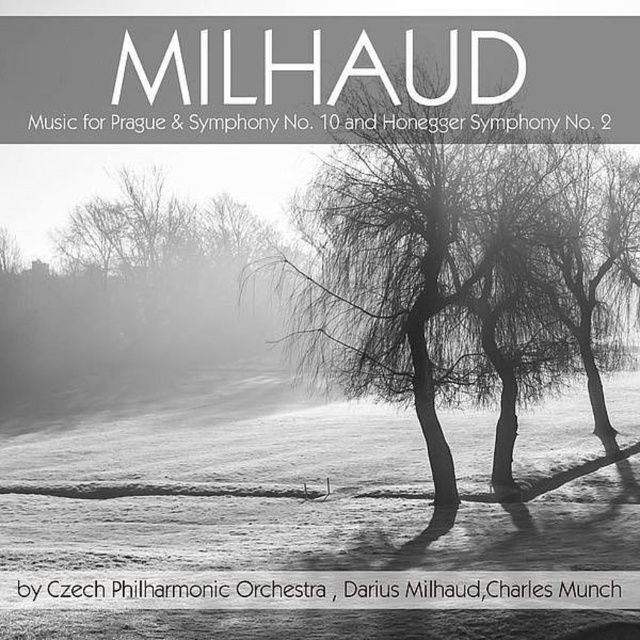
Who is positioned more to the right, white powder snow at center or smooth bark tree at center?

smooth bark tree at center is more to the right.

Is white powder snow at center smaller than smooth bark tree at center?

Actually, white powder snow at center might be larger than smooth bark tree at center.

Who is more forward, (417,548) or (548,333)?

Point (417,548) is in front.

This screenshot has width=640, height=640. I want to click on white powder snow at center, so click(x=300, y=490).

Is smooth bark tree at center above silvery bark tree at center?

No, smooth bark tree at center is not above silvery bark tree at center.

Can you confirm if smooth bark tree at center is taller than silvery bark tree at center?

In fact, smooth bark tree at center may be shorter than silvery bark tree at center.

Identify the location of smooth bark tree at center. The image size is (640, 640). tap(435, 275).

Can you confirm if white powder snow at center is thinner than silvery bark tree at center?

No, white powder snow at center is not thinner than silvery bark tree at center.

Does white powder snow at center have a larger size compared to silvery bark tree at center?

No, white powder snow at center is not bigger than silvery bark tree at center.

Is point (276, 518) less distant than point (134, 312)?

Yes, it is in front of point (134, 312).

Identify the location of white powder snow at center. (300, 490).